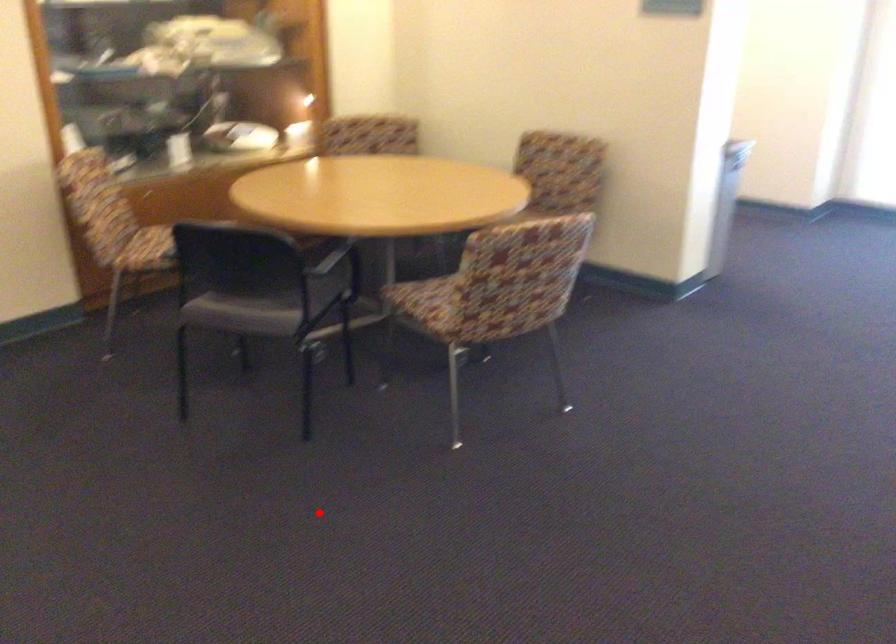
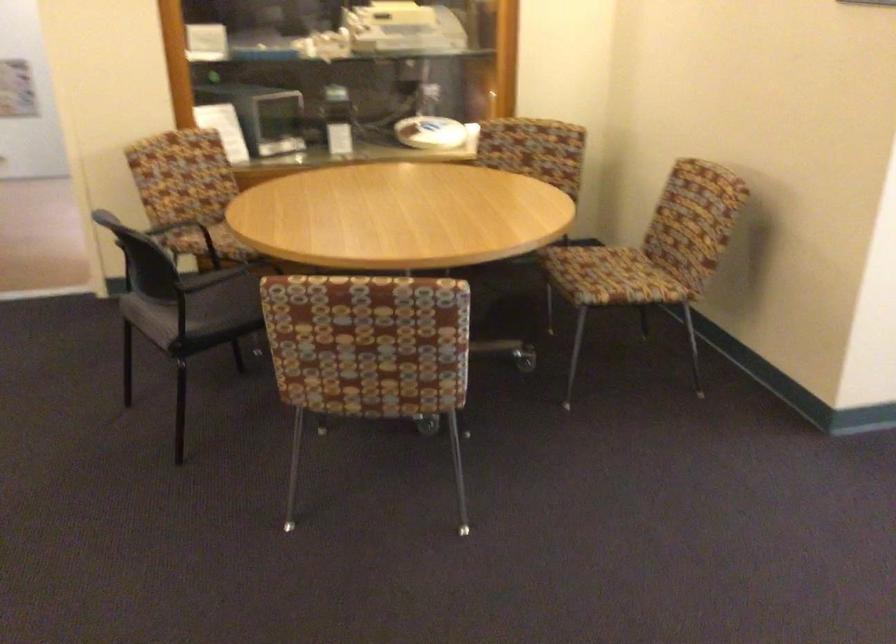
The point at the highlighted location is marked in the first image. Where is the corresponding point in the second image?

(90, 534)